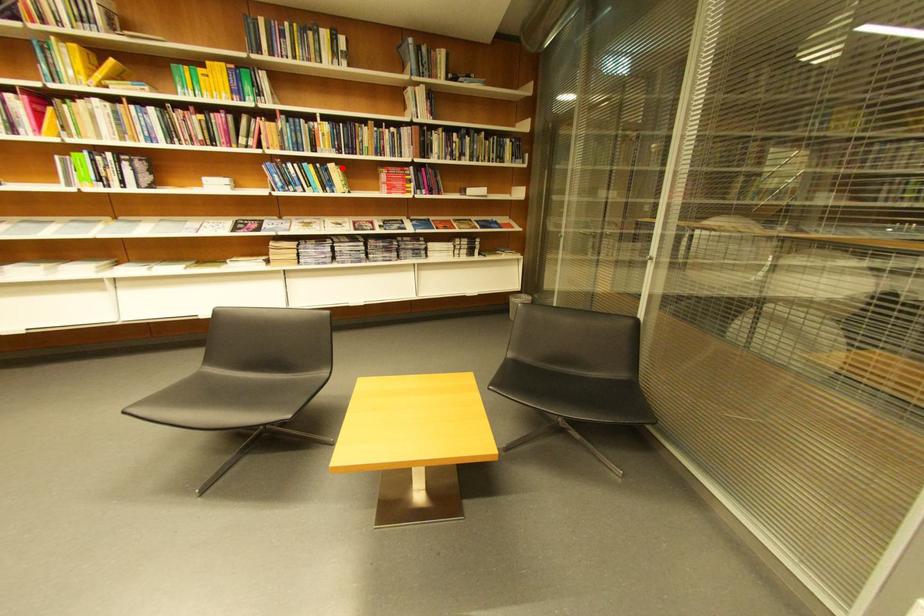
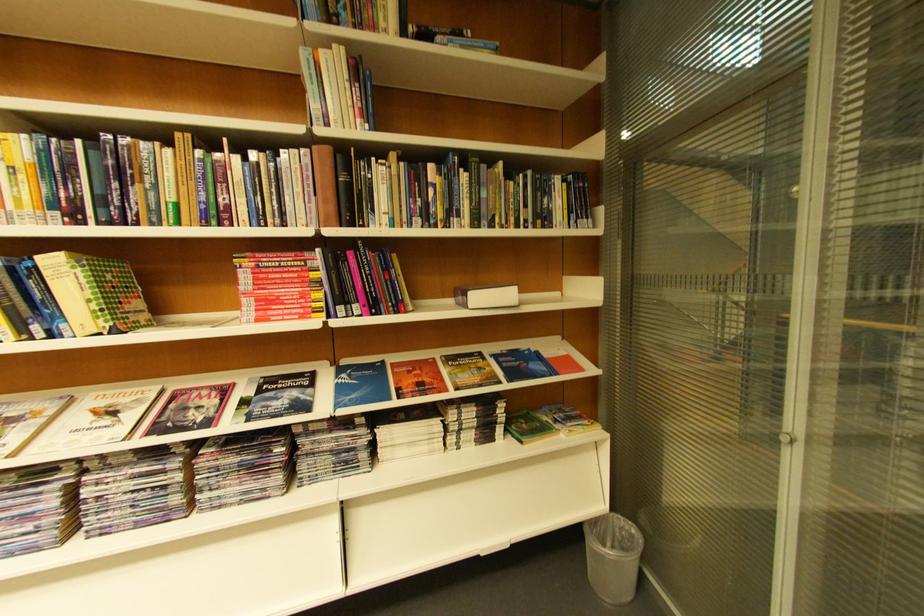
The point at the highlighted location is marked in the first image. Where is the corresponding point in the second image?

(63, 264)